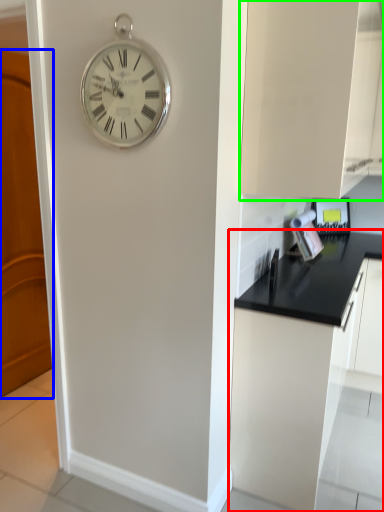
Question: Estimate the real-world distances between objects in this image. Which object is farther from cabinetry (highlighted by a red box), door (highlighted by a blue box) or cabinetry (highlighted by a green box)?

Choices:
 (A) door
 (B) cabinetry

Answer: (A)